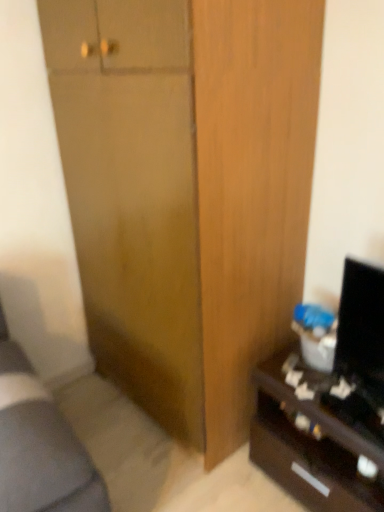
Question: Should I look upward or downward to see wooden cabinet at center?

Choices:
 (A) down
 (B) up

Answer: (B)

Question: Does wooden cabinet at center touch black glossy desk at lower right?

Choices:
 (A) no
 (B) yes

Answer: (A)

Question: From a real-world perspective, is wooden cabinet at center beneath black glossy desk at lower right?

Choices:
 (A) no
 (B) yes

Answer: (A)

Question: From the image's perspective, is wooden cabinet at center above black glossy desk at lower right?

Choices:
 (A) yes
 (B) no

Answer: (A)

Question: Is wooden cabinet at center aimed at black glossy desk at lower right?

Choices:
 (A) no
 (B) yes

Answer: (A)

Question: From a real-world perspective, is wooden cabinet at center over black glossy desk at lower right?

Choices:
 (A) no
 (B) yes

Answer: (B)

Question: From the image's perspective, is wooden cabinet at center beneath black glossy desk at lower right?

Choices:
 (A) no
 (B) yes

Answer: (A)

Question: Can you see black glossy desk at lower right touching wooden cabinet at center?

Choices:
 (A) no
 (B) yes

Answer: (A)

Question: From a real-world perspective, is black glossy desk at lower right on top of wooden cabinet at center?

Choices:
 (A) yes
 (B) no

Answer: (B)

Question: Does black glossy desk at lower right have a greater width compared to wooden cabinet at center?

Choices:
 (A) no
 (B) yes

Answer: (A)

Question: From the image's perspective, would you say black glossy desk at lower right is shown under wooden cabinet at center?

Choices:
 (A) no
 (B) yes

Answer: (B)

Question: Can you confirm if black glossy desk at lower right is taller than wooden cabinet at center?

Choices:
 (A) yes
 (B) no

Answer: (B)

Question: From a real-world perspective, is black glossy desk at lower right located beneath wooden cabinet at center?

Choices:
 (A) no
 (B) yes

Answer: (B)

Question: Which is correct: wooden cabinet at center is inside black glossy desk at lower right, or outside of it?

Choices:
 (A) outside
 (B) inside

Answer: (A)